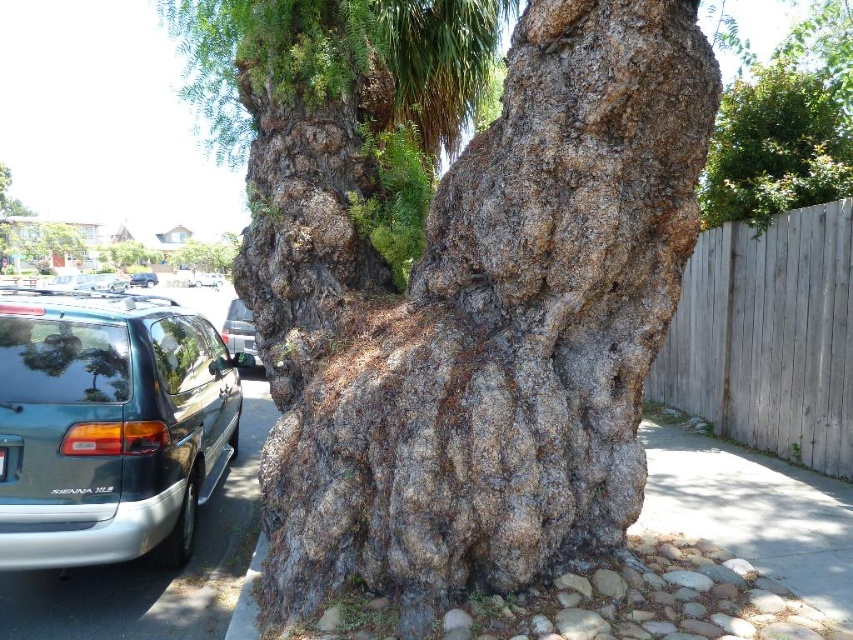
You are a delivery driver approaching the gray concrete curb at lower center and the metallic silver minivan at center. Which object is taller?

The metallic silver minivan at center is taller than the gray concrete curb at lower center.

You are standing at the base of the large tree trunk and want to walk to the gray concrete curb at lower center. According to the coordinates provided, in which direction should you walk to reach the curb?

The gray concrete curb at lower center is located at coordinates point (248, 596). Since the coordinate system typically has the origin at the bottom left corner, moving towards higher x values means moving to the right and higher y values mean moving upwards. Therefore, to reach the curb, you should walk to the right and slightly upwards from the tree trunk.

You are standing in front of the rough bark tree trunk at center and want to reach the metallic silver minivan at center. Which direction should you move to get closer to the minivan?

You should move away from the rough bark tree trunk at center because it is closer to you than the metallic silver minivan at center, so moving backward would bring you nearer to the minivan.